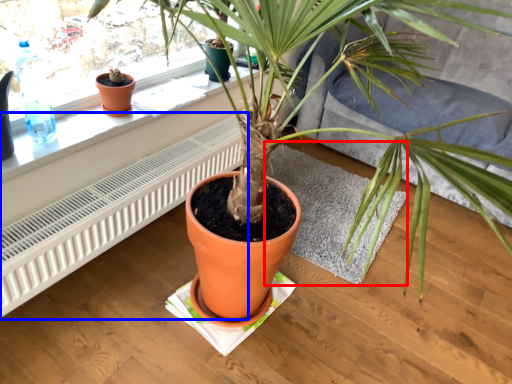
Question: Which object appears closest to the camera in this image, wide (highlighted by a red box) or air conditioner (highlighted by a blue box)?

Choices:
 (A) wide
 (B) air conditioner

Answer: (B)